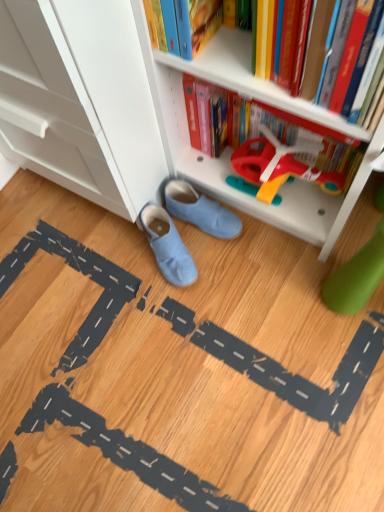
Question: From the image's perspective, is white plastic bookcase at lower center below light blue suede shoes at center, which ranks as the 1th footwear in bottom-to-top order?

Choices:
 (A) yes
 (B) no

Answer: (B)

Question: From the image's perspective, is white plastic bookcase at lower center above light blue suede shoes at center, which ranks as the 1th footwear in bottom-to-top order?

Choices:
 (A) no
 (B) yes

Answer: (B)

Question: Does white plastic bookcase at lower center have a larger size compared to light blue suede shoes at center, which appears as the second footwear when viewed from the top?

Choices:
 (A) no
 (B) yes

Answer: (B)

Question: Is white plastic bookcase at lower center to the right of light blue suede shoes at center, which appears as the second footwear when viewed from the top, from the viewer's perspective?

Choices:
 (A) yes
 (B) no

Answer: (A)

Question: Can light blue suede shoes at center, which appears as the second footwear when viewed from the top, be found inside white plastic bookcase at lower center?

Choices:
 (A) yes
 (B) no

Answer: (B)

Question: From a real-world perspective, is hardcover book at upper center above or below light blue suede shoes at center, which ranks as the 1th footwear in bottom-to-top order?

Choices:
 (A) below
 (B) above

Answer: (B)

Question: Considering the positions of hardcover book at upper center and light blue suede shoes at center, which appears as the second footwear when viewed from the top, in the image, is hardcover book at upper center bigger or smaller than light blue suede shoes at center, which appears as the second footwear when viewed from the top,?

Choices:
 (A) big
 (B) small

Answer: (A)

Question: From the image's perspective, relative to light blue suede shoes at center, which appears as the second footwear when viewed from the top, is hardcover book at upper center above or below?

Choices:
 (A) below
 (B) above

Answer: (B)

Question: Is point (238, 53) closer or farther from the camera than point (175, 256)?

Choices:
 (A) closer
 (B) farther

Answer: (A)

Question: Looking at the image, does white plastic bookcase at lower center seem bigger or smaller compared to light blue suede shoes at center, which appears as the second footwear when viewed from the top?

Choices:
 (A) big
 (B) small

Answer: (A)

Question: Which is correct: white plastic bookcase at lower center is inside light blue suede shoes at center, which appears as the second footwear when viewed from the top, or outside of it?

Choices:
 (A) inside
 (B) outside

Answer: (B)

Question: Looking at their shapes, would you say white plastic bookcase at lower center is wider or thinner than light blue suede shoes at center, which ranks as the 1th footwear in bottom-to-top order?

Choices:
 (A) wide
 (B) thin

Answer: (A)

Question: Would you say white plastic bookcase at lower center is to the left or to the right of light blue suede shoes at center, which appears as the second footwear when viewed from the top, in the picture?

Choices:
 (A) right
 (B) left

Answer: (A)

Question: Is hardcover book at upper center wider or thinner than white plastic bookcase at lower center?

Choices:
 (A) thin
 (B) wide

Answer: (A)

Question: Do you think hardcover book at upper center is within white plastic bookcase at lower center, or outside of it?

Choices:
 (A) outside
 (B) inside

Answer: (B)